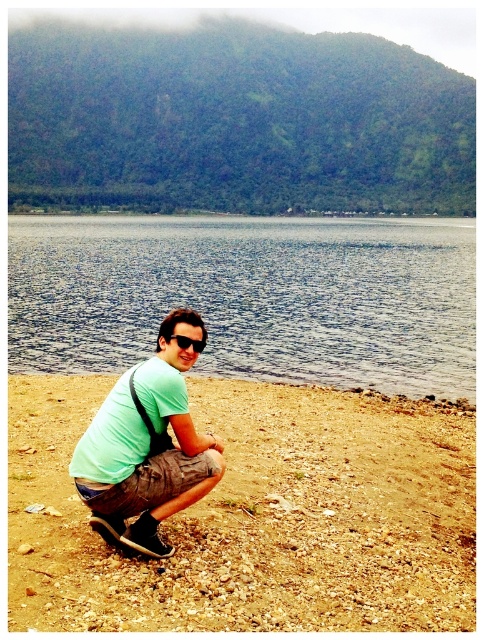
Question: Which of the following is the farthest from the observer?

Choices:
 (A) black plastic sunglasses at center
 (B) blue water at center
 (C) green matte shirt at center
 (D) brown gravelly sand at lower center

Answer: (B)

Question: Is the position of green matte shirt at center less distant than that of black plastic sunglasses at center?

Choices:
 (A) no
 (B) yes

Answer: (B)

Question: Does blue water at center have a smaller size compared to green matte shirt at center?

Choices:
 (A) yes
 (B) no

Answer: (B)

Question: Which object appears farthest from the camera in this image?

Choices:
 (A) black plastic sunglasses at center
 (B) blue water at center

Answer: (B)

Question: Which point is farther to the camera?

Choices:
 (A) (200, 342)
 (B) (342, 358)

Answer: (B)

Question: Is the position of brown gravelly sand at lower center less distant than that of green matte shirt at center?

Choices:
 (A) no
 (B) yes

Answer: (B)